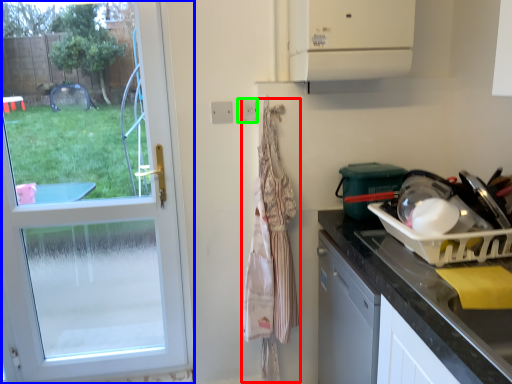
Question: Which object is the closest to the clothesline (highlighted by a red box)? Choose among these: door (highlighted by a blue box) or electric outlet (highlighted by a green box).

Choices:
 (A) door
 (B) electric outlet

Answer: (B)